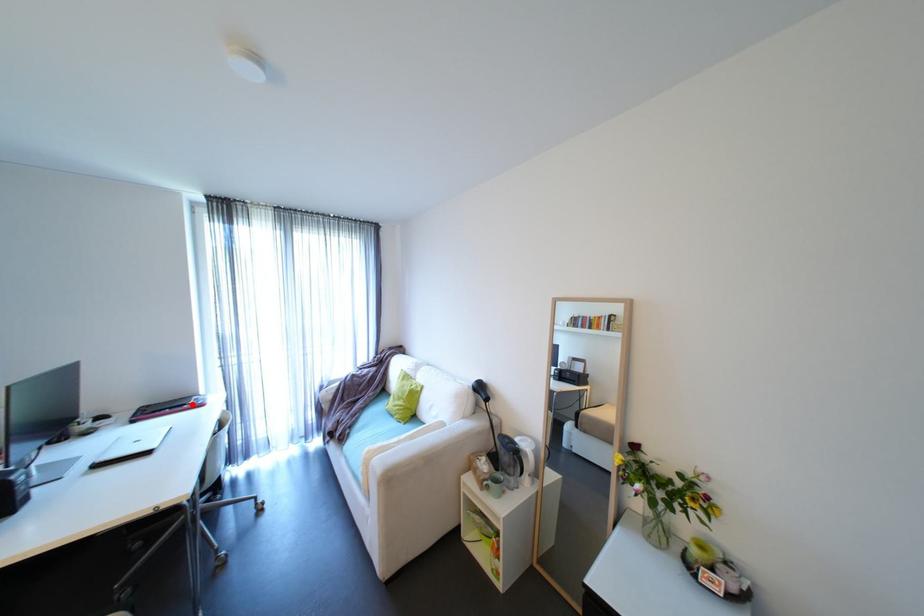
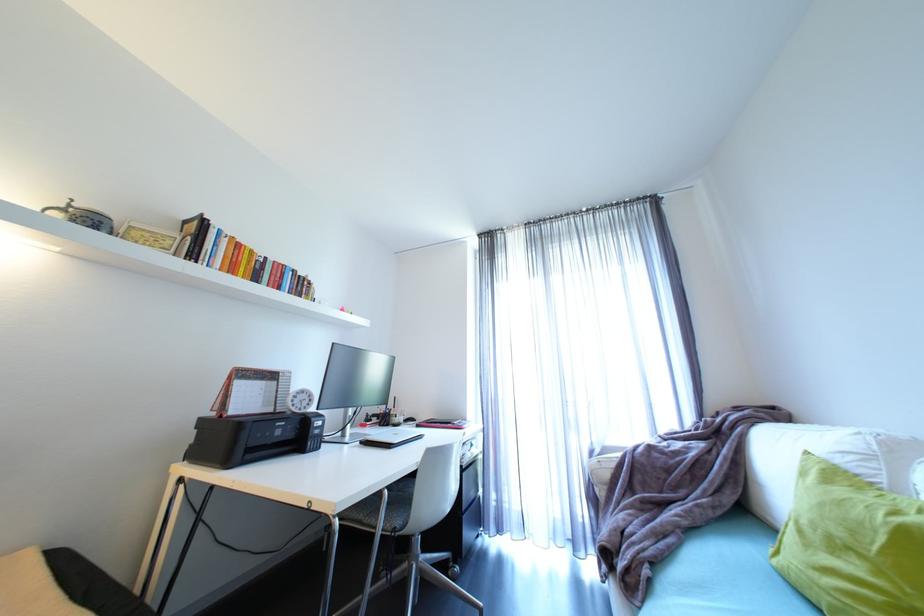
Locate, in the second image, the point that corresponds to the highlighted location in the first image.

(457, 424)